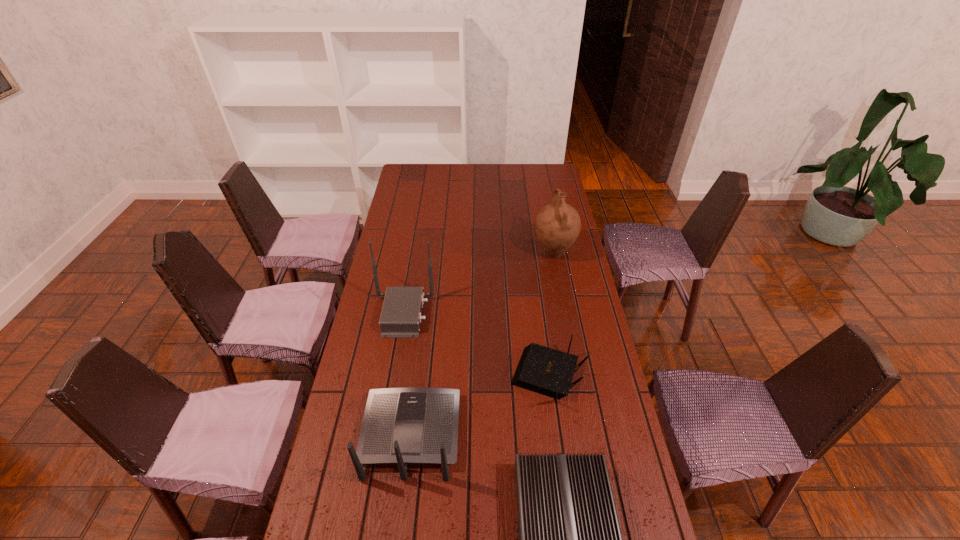
I want to click on router that is at the right edge, so click(x=547, y=371).

The width and height of the screenshot is (960, 540). I want to click on free space at the far edge of the desktop, so [x=502, y=179].

Image resolution: width=960 pixels, height=540 pixels. I want to click on vacant area at the left edge, so click(390, 244).

Where is `vacant space at the right edge`? The height and width of the screenshot is (540, 960). vacant space at the right edge is located at coordinates (566, 276).

Identify the location of free space at the far left corner. (417, 178).

The width and height of the screenshot is (960, 540). What are the coordinates of `free space at the far right corner` in the screenshot? It's located at (557, 166).

Image resolution: width=960 pixels, height=540 pixels. In order to click on vacant space that is in between the farthest object and the third shortest object in this screenshot , I will do `click(482, 344)`.

The image size is (960, 540). What are the coordinates of `free area in between the third tallest object and the fourth nearest object` in the screenshot? It's located at (407, 375).

Image resolution: width=960 pixels, height=540 pixels. I want to click on object that can be found as the third closest to the pitcher, so click(401, 426).

Locate which object is the closest to the pitcher. Please provide its 2D coordinates. Your answer should be formatted as a tuple, i.e. [(x, y)], where the tuple contains the x and y coordinates of a point satisfying the conditions above.

[(547, 371)]